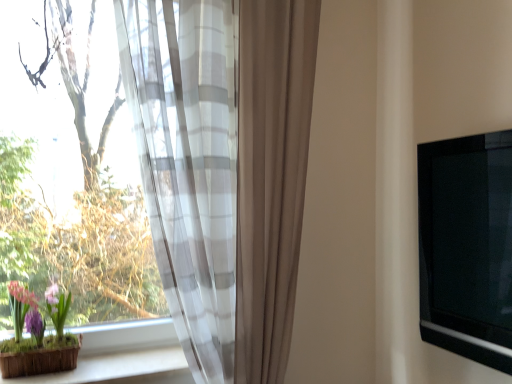
Question: Is matte brown pot at lower left facing towards black glossy tv at right?

Choices:
 (A) yes
 (B) no

Answer: (B)

Question: From a real-world perspective, is matte brown pot at lower left located higher than black glossy tv at right?

Choices:
 (A) no
 (B) yes

Answer: (A)

Question: Can you confirm if matte brown pot at lower left is smaller than black glossy tv at right?

Choices:
 (A) yes
 (B) no

Answer: (A)

Question: Is matte brown pot at lower left far away from black glossy tv at right?

Choices:
 (A) yes
 (B) no

Answer: (A)

Question: Can we say matte brown pot at lower left lies outside black glossy tv at right?

Choices:
 (A) no
 (B) yes

Answer: (B)

Question: Considering the relative sizes of matte brown pot at lower left and black glossy tv at right in the image provided, is matte brown pot at lower left bigger than black glossy tv at right?

Choices:
 (A) no
 (B) yes

Answer: (A)

Question: From the image's perspective, is transparent fabric at left above sheer white and gray striped curtain at left?

Choices:
 (A) yes
 (B) no

Answer: (A)

Question: Is transparent fabric at left to the right of sheer white and gray striped curtain at left from the viewer's perspective?

Choices:
 (A) yes
 (B) no

Answer: (B)

Question: Is transparent fabric at left at the left side of sheer white and gray striped curtain at left?

Choices:
 (A) no
 (B) yes

Answer: (B)

Question: Is sheer white and gray striped curtain at left located within transparent fabric at left?

Choices:
 (A) yes
 (B) no

Answer: (B)

Question: Is transparent fabric at left facing away from sheer white and gray striped curtain at left?

Choices:
 (A) no
 (B) yes

Answer: (A)

Question: Would you consider transparent fabric at left to be distant from sheer white and gray striped curtain at left?

Choices:
 (A) yes
 (B) no

Answer: (B)

Question: Does wooden at lower left have a greater height compared to transparent fabric at left?

Choices:
 (A) no
 (B) yes

Answer: (A)